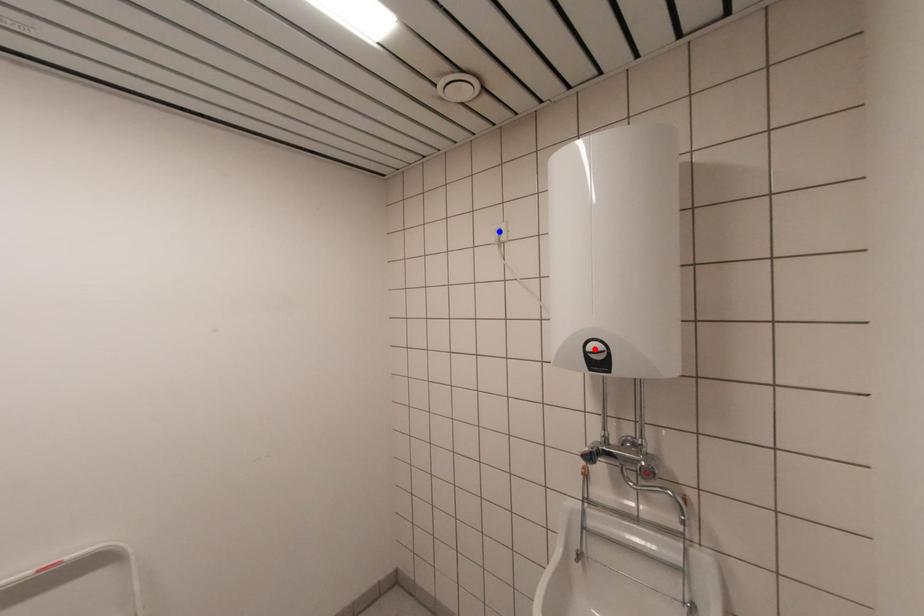
Question: In the image, two points are highlighted. Which point is nearer to the camera? Reply with the corresponding letter.

Choices:
 (A) blue point
 (B) red point

Answer: (B)